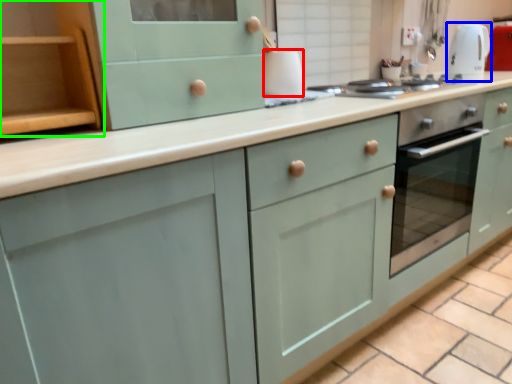
Question: Which is nearer to the appliance (highlighted by a red box)? kitchen appliance (highlighted by a blue box) or cabinetry (highlighted by a green box).

Choices:
 (A) kitchen appliance
 (B) cabinetry

Answer: (B)